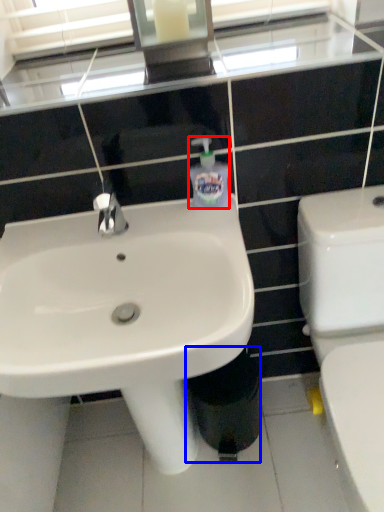
Question: Which object is closer to the camera taking this photo, toiletries (highlighted by a red box) or trash bin/can (highlighted by a blue box)?

Choices:
 (A) toiletries
 (B) trash bin/can

Answer: (A)